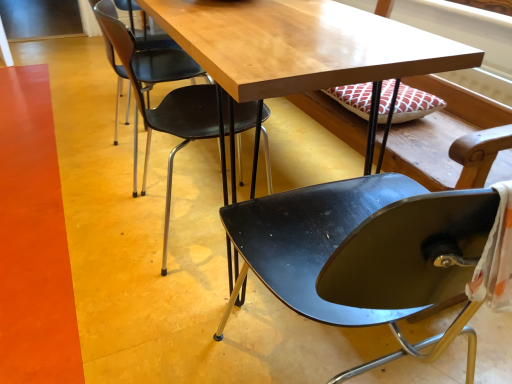
What do you see at coordinates (300, 45) in the screenshot? I see `wooden table at center` at bounding box center [300, 45].

The width and height of the screenshot is (512, 384). Describe the element at coordinates (165, 96) in the screenshot. I see `black plastic chair at upper center, which is the 2th chair from right to left` at that location.

In order to face glossy black chair at center, arranged as the 1th chair when viewed from the right, should I rotate leftwards or rightwards?

You should look right and rotate roughly 13.511 degrees.

I want to click on wooden table at center, so click(x=300, y=45).

Considering the relative sizes of glossy black chair at center, which is counted as the 2th chair, starting from the left, and wooden table at center in the image provided, is glossy black chair at center, which is counted as the 2th chair, starting from the left, shorter than wooden table at center?

Indeed, glossy black chair at center, which is counted as the 2th chair, starting from the left, has a lesser height compared to wooden table at center.

Could you measure the distance between glossy black chair at center, arranged as the 1th chair when viewed from the right, and wooden table at center?

glossy black chair at center, arranged as the 1th chair when viewed from the right, is 34.09 centimeters from wooden table at center.

Is glossy black chair at center, arranged as the 1th chair when viewed from the right, in contact with wooden table at center?

No, glossy black chair at center, arranged as the 1th chair when viewed from the right, is not next to wooden table at center.

From a real-world perspective, is glossy black chair at center, which is counted as the 2th chair, starting from the left, physically located above or below wooden table at center?

glossy black chair at center, which is counted as the 2th chair, starting from the left, is below wooden table at center.

Is point (357, 47) behind point (98, 8)?

No, (357, 47) is closer to viewer.

Measure the distance between wooden table at center and black plastic chair at upper center, which is the 2th chair from right to left.

wooden table at center is 12.95 inches from black plastic chair at upper center, which is the 2th chair from right to left.

From the image's perspective, is wooden table at center located beneath black plastic chair at upper center, acting as the 1th chair starting from the left?

Actually, wooden table at center appears above black plastic chair at upper center, acting as the 1th chair starting from the left, in the image.

Is wooden table at center turned away from black plastic chair at upper center, which is the 2th chair from right to left?

Yes.

Locate an element on the screen. The height and width of the screenshot is (384, 512). chair that appears below the glossy black chair at center, arranged as the 1th chair when viewed from the right (from a real-world perspective) is located at coordinates pyautogui.click(x=165, y=96).

Can you tell me how much glossy black chair at center, arranged as the 1th chair when viewed from the right, and black plastic chair at upper center, which is the 2th chair from right to left, differ in facing direction?

The angular difference between glossy black chair at center, arranged as the 1th chair when viewed from the right, and black plastic chair at upper center, which is the 2th chair from right to left, is 90 degrees.

Is glossy black chair at center, arranged as the 1th chair when viewed from the right, beside black plastic chair at upper center, acting as the 1th chair starting from the left?

glossy black chair at center, arranged as the 1th chair when viewed from the right, and black plastic chair at upper center, acting as the 1th chair starting from the left, are clearly separated.

From the image's perspective, who appears lower, glossy black chair at center, which is counted as the 2th chair, starting from the left, or black plastic chair at upper center, which is the 2th chair from right to left?

glossy black chair at center, which is counted as the 2th chair, starting from the left, from the image's perspective.

From the image's perspective, is wooden table at center under glossy black chair at center, which is counted as the 2th chair, starting from the left?

No.

From a real-world perspective, is wooden table at center physically above glossy black chair at center, which is counted as the 2th chair, starting from the left?

Yes, from a real-world perspective, wooden table at center is over glossy black chair at center, which is counted as the 2th chair, starting from the left

From the picture: Is glossy black chair at center, which is counted as the 2th chair, starting from the left, a part of wooden table at center?

No, glossy black chair at center, which is counted as the 2th chair, starting from the left, is not surrounded by wooden table at center.

Would you consider wooden table at center to be distant from glossy black chair at center, arranged as the 1th chair when viewed from the right?

No, wooden table at center is not far away from glossy black chair at center, arranged as the 1th chair when viewed from the right.

From a real-world perspective, is black plastic chair at upper center, which is the 2th chair from right to left, located higher than wooden table at center?

No.

Between black plastic chair at upper center, acting as the 1th chair starting from the left, and wooden table at center, which one has smaller width?

With smaller width is black plastic chair at upper center, acting as the 1th chair starting from the left.

Based on their sizes in the image, would you say black plastic chair at upper center, which is the 2th chair from right to left, is bigger or smaller than wooden table at center?

black plastic chair at upper center, which is the 2th chair from right to left, is smaller than wooden table at center.

Considering the points (156, 61) and (295, 288), which point is in front, point (156, 61) or point (295, 288)?

The point (295, 288) is closer to the camera.

Locate an element on the screen. The width and height of the screenshot is (512, 384). chair below the black plastic chair at upper center, acting as the 1th chair starting from the left (from the image's perspective) is located at coordinates (312, 246).

From the image's perspective, does black plastic chair at upper center, which is the 2th chair from right to left, appear lower than glossy black chair at center, arranged as the 1th chair when viewed from the right?

No.

From a real-world perspective, is black plastic chair at upper center, which is the 2th chair from right to left, located beneath glossy black chair at center, arranged as the 1th chair when viewed from the right?

Indeed, from a real-world perspective, black plastic chair at upper center, which is the 2th chair from right to left, is positioned beneath glossy black chair at center, arranged as the 1th chair when viewed from the right.

The height and width of the screenshot is (384, 512). In order to click on table above the glossy black chair at center, arranged as the 1th chair when viewed from the right (from a real-world perspective) in this screenshot , I will do `click(300, 45)`.

Where is `table in front of the black plastic chair at upper center, which is the 2th chair from right to left`? table in front of the black plastic chair at upper center, which is the 2th chair from right to left is located at coordinates (300, 45).

In the scene shown: From the image, which object appears to be farther from black plastic chair at upper center, which is the 2th chair from right to left, wooden table at center or glossy black chair at center, which is counted as the 2th chair, starting from the left?

Among the two, glossy black chair at center, which is counted as the 2th chair, starting from the left, is located further to black plastic chair at upper center, which is the 2th chair from right to left.

Consider the image. Which object lies nearer to the anchor point wooden table at center, black plastic chair at upper center, which is the 2th chair from right to left, or glossy black chair at center, arranged as the 1th chair when viewed from the right?

Among the two, black plastic chair at upper center, which is the 2th chair from right to left, is located nearer to wooden table at center.

From the image, which object appears to be farther from glossy black chair at center, which is counted as the 2th chair, starting from the left, black plastic chair at upper center, which is the 2th chair from right to left, or wooden table at center?

black plastic chair at upper center, which is the 2th chair from right to left, is positioned further to the anchor glossy black chair at center, which is counted as the 2th chair, starting from the left.

When comparing their distances from black plastic chair at upper center, which is the 2th chair from right to left, does glossy black chair at center, arranged as the 1th chair when viewed from the right, or wooden table at center seem further?

Among the two, glossy black chair at center, arranged as the 1th chair when viewed from the right, is located further to black plastic chair at upper center, which is the 2th chair from right to left.

Estimate the real-world distances between objects in this image. Which object is further from glossy black chair at center, arranged as the 1th chair when viewed from the right, wooden table at center or black plastic chair at upper center, acting as the 1th chair starting from the left?

Among the two, black plastic chair at upper center, acting as the 1th chair starting from the left, is located further to glossy black chair at center, arranged as the 1th chair when viewed from the right.

Looking at this image, estimate the real-world distances between objects in this image. Which object is further from wooden table at center, glossy black chair at center, arranged as the 1th chair when viewed from the right, or black plastic chair at upper center, which is the 2th chair from right to left?

Based on the image, glossy black chair at center, arranged as the 1th chair when viewed from the right, appears to be further to wooden table at center.

Where is `table between glossy black chair at center, arranged as the 1th chair when viewed from the right, and black plastic chair at upper center, acting as the 1th chair starting from the left, from front to back`? The image size is (512, 384). table between glossy black chair at center, arranged as the 1th chair when viewed from the right, and black plastic chair at upper center, acting as the 1th chair starting from the left, from front to back is located at coordinates (300, 45).